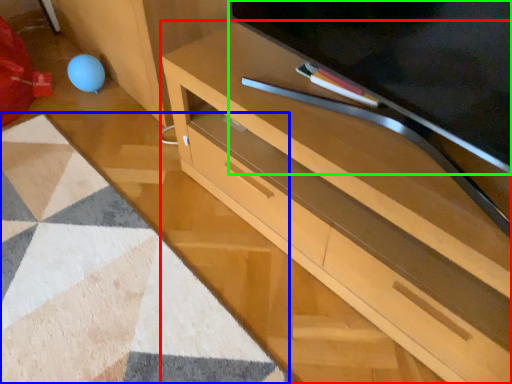
Question: Which object is the closest to the desk (highlighted by a red box)? Choose among these: mat (highlighted by a blue box) or television (highlighted by a green box).

Choices:
 (A) mat
 (B) television

Answer: (B)